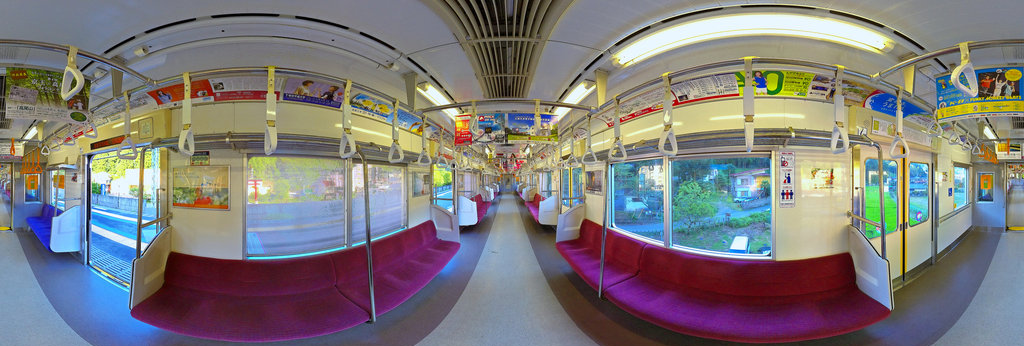
At what (x,y) coordinates should I click in order to perform the action: click on doorway. Please return your answer as a coordinate pair (x, y). The image size is (1024, 346). Looking at the image, I should click on (88, 193).